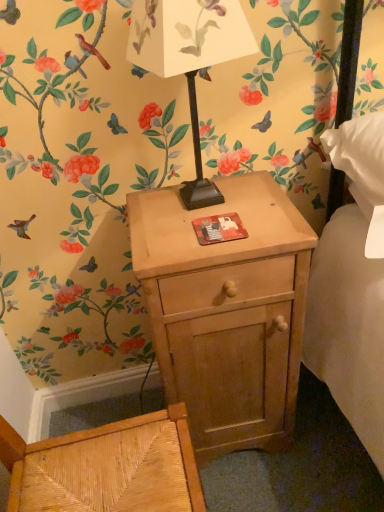
This screenshot has width=384, height=512. I want to click on matte black table lamp at center, so click(189, 58).

Describe the element at coordinates (189, 58) in the screenshot. I see `matte black table lamp at center` at that location.

The height and width of the screenshot is (512, 384). What are the coordinates of `light wood nightstand at center` in the screenshot? It's located at (226, 311).

What is the approximate width of light wood nightstand at center?

light wood nightstand at center is 13.62 inches in width.

This screenshot has width=384, height=512. Describe the element at coordinates (226, 311) in the screenshot. I see `light wood nightstand at center` at that location.

The height and width of the screenshot is (512, 384). Find the location of `matte black table lamp at center`. matte black table lamp at center is located at coordinates (189, 58).

Is light wood nightstand at center to the right of matte black table lamp at center from the viewer's perspective?

Yes.

Who is more distant, light wood nightstand at center or matte black table lamp at center?

light wood nightstand at center is further from the camera.

Which is nearer, (x=226, y=332) or (x=197, y=180)?

Point (x=226, y=332)

From the image's perspective, relative to matte black table lamp at center, is light wood nightstand at center above or below?

light wood nightstand at center is situated lower than matte black table lamp at center in the image.

From a real-world perspective, is light wood nightstand at center physically located above or below matte black table lamp at center?

Clearly, from a real-world perspective, light wood nightstand at center is below matte black table lamp at center.

Between light wood nightstand at center and matte black table lamp at center, which one has larger width?

light wood nightstand at center.

Can you confirm if light wood nightstand at center is taller than matte black table lamp at center?

Indeed, light wood nightstand at center has a greater height compared to matte black table lamp at center.

Looking at this image, in terms of size, does light wood nightstand at center appear bigger or smaller than matte black table lamp at center?

Considering their sizes, light wood nightstand at center takes up more space than matte black table lamp at center.

Is light wood nightstand at center positioned beyond the bounds of matte black table lamp at center?

Yes, light wood nightstand at center is outside of matte black table lamp at center.

Looking at this image, is light wood nightstand at center far away from matte black table lamp at center?

No, light wood nightstand at center is not far from matte black table lamp at center.

Is light wood nightstand at center oriented towards matte black table lamp at center?

No, light wood nightstand at center is not facing towards matte black table lamp at center.

How different are the orientations of light wood nightstand at center and matte black table lamp at center in degrees?

They differ by 3.87 degrees in their facing directions.

Measure the distance from light wood nightstand at center to matte black table lamp at center.

light wood nightstand at center and matte black table lamp at center are 12.73 inches apart from each other.

Find the location of a particular element. nightstand that appears below the matte black table lamp at center (from the image's perspective) is located at coordinates (226, 311).

Is matte black table lamp at center at the right side of light wood nightstand at center?

No.

Which object is further away from the camera, matte black table lamp at center or light wood nightstand at center?

light wood nightstand at center is more distant.

Does point (198, 1) lie behind point (262, 329)?

No, it is in front of (262, 329).

From the image's perspective, is matte black table lamp at center located above or below light wood nightstand at center?

From the image's perspective, matte black table lamp at center appears above light wood nightstand at center.

From a real-world perspective, is matte black table lamp at center located beneath light wood nightstand at center?

No, from a real-world perspective, matte black table lamp at center is not under light wood nightstand at center.

Looking at this image, considering the sizes of objects matte black table lamp at center and light wood nightstand at center in the image provided, who is wider, matte black table lamp at center or light wood nightstand at center?

With larger width is light wood nightstand at center.

Who is taller, matte black table lamp at center or light wood nightstand at center?

light wood nightstand at center is taller.

Considering the relative sizes of matte black table lamp at center and light wood nightstand at center in the image provided, is matte black table lamp at center smaller than light wood nightstand at center?

Yes.

Looking at this image, is matte black table lamp at center inside the boundaries of light wood nightstand at center, or outside?

matte black table lamp at center is spatially situated outside light wood nightstand at center.

Is there a large distance between matte black table lamp at center and light wood nightstand at center?

They are positioned close to each other.

Is matte black table lamp at center oriented towards light wood nightstand at center?

No, matte black table lamp at center does not turn towards light wood nightstand at center.

How many degrees apart are the facing directions of matte black table lamp at center and light wood nightstand at center?

3.87 degrees separate the facing orientations of matte black table lamp at center and light wood nightstand at center.

Identify the location of nightstand below the matte black table lamp at center (from the image's perspective). The width and height of the screenshot is (384, 512). (226, 311).

Identify the location of nightstand lying on the right of matte black table lamp at center. (226, 311).

This screenshot has width=384, height=512. I want to click on table lamp above the light wood nightstand at center (from the image's perspective), so click(x=189, y=58).